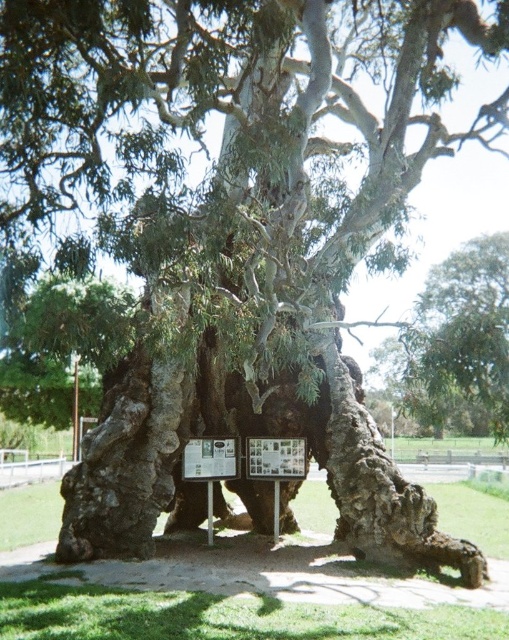
Question: Can you confirm if wooden signboard at center is positioned to the right of metallic plaque at center?

Choices:
 (A) no
 (B) yes

Answer: (B)

Question: Which object is closer to the camera taking this photo?

Choices:
 (A) metallic plaque at center
 (B) wooden signboard at center

Answer: (A)

Question: Is the position of wooden signboard at center more distant than that of metallic plaque at center?

Choices:
 (A) no
 (B) yes

Answer: (B)

Question: Is wooden signboard at center to the left of metallic plaque at center from the viewer's perspective?

Choices:
 (A) yes
 (B) no

Answer: (B)

Question: Among these points, which one is nearest to the camera?

Choices:
 (A) (200, 474)
 (B) (268, 456)

Answer: (A)